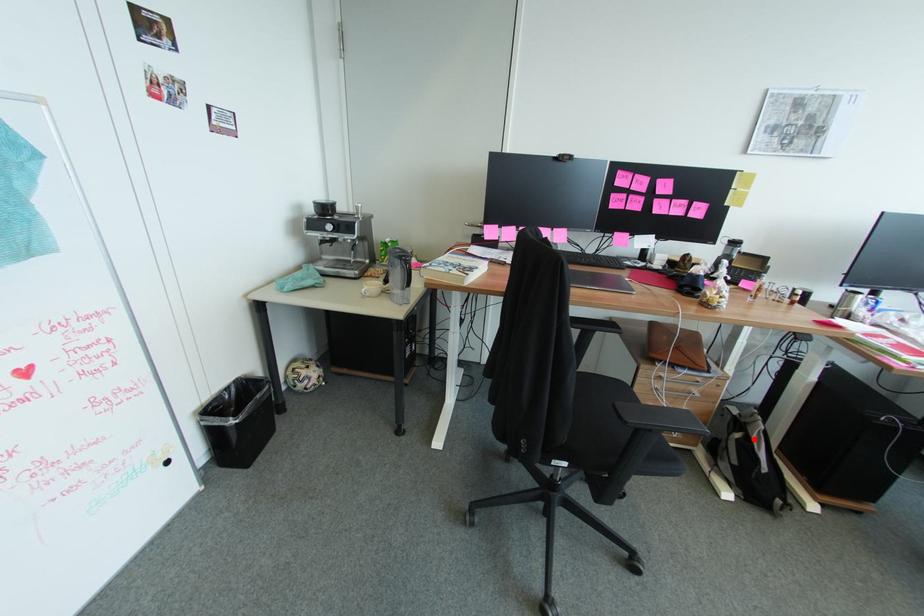
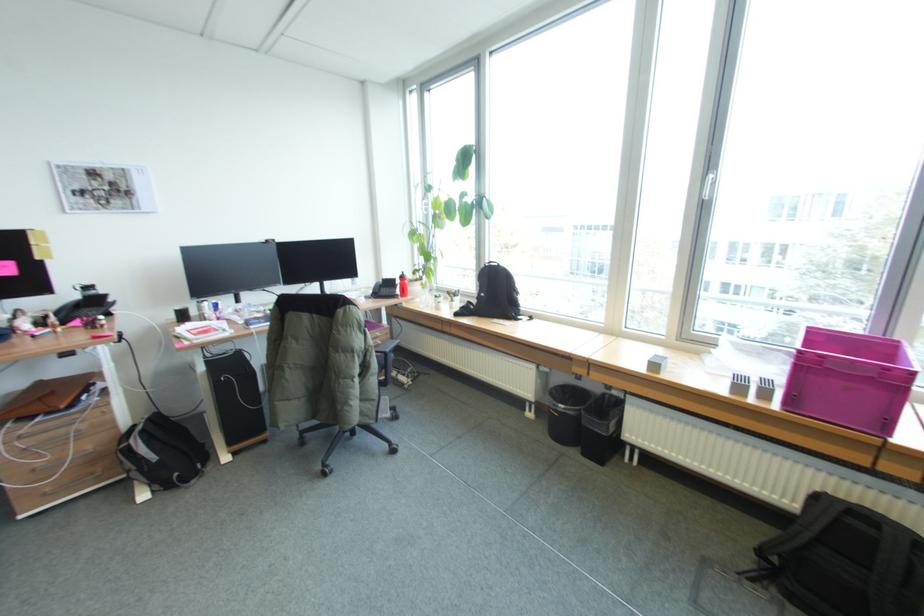
The point at the highlighted location is marked in the first image. Where is the corresponding point in the second image?

(135, 444)